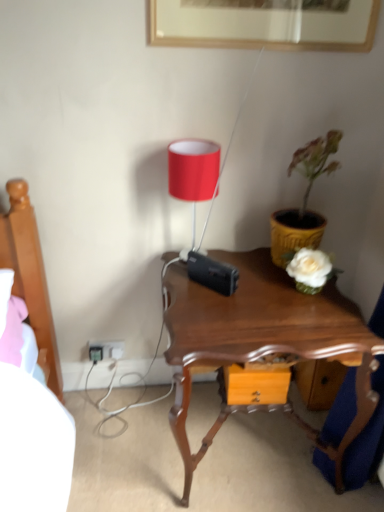
You are a GUI agent. You are given a task and a screenshot of the screen. Output one action in this format:
    pyautogui.click(x=<x>, y=<y>)
    Task: Click on the free location to the left of yellow textured pot at right
    The height and width of the screenshot is (512, 384).
    Given the screenshot: What is the action you would take?
    pyautogui.click(x=249, y=266)